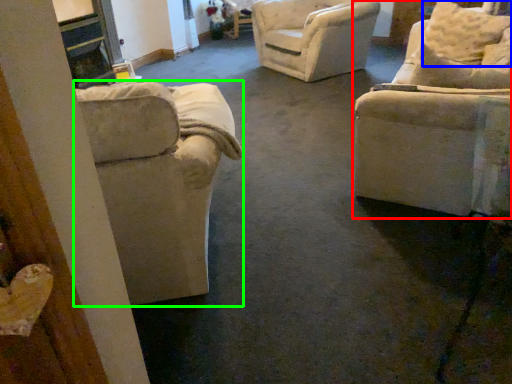
Question: Based on their relative distances, which object is farther from chair (highlighted by a red box)? Choose from pillow (highlighted by a blue box) and chair (highlighted by a green box).

Choices:
 (A) pillow
 (B) chair

Answer: (A)